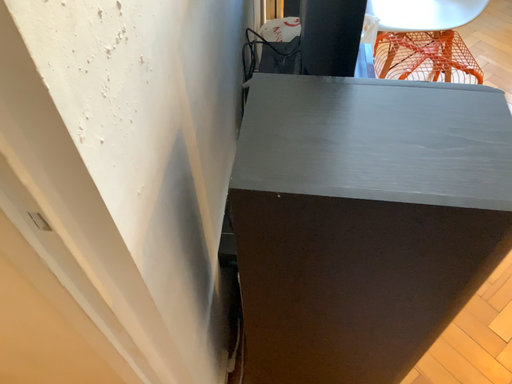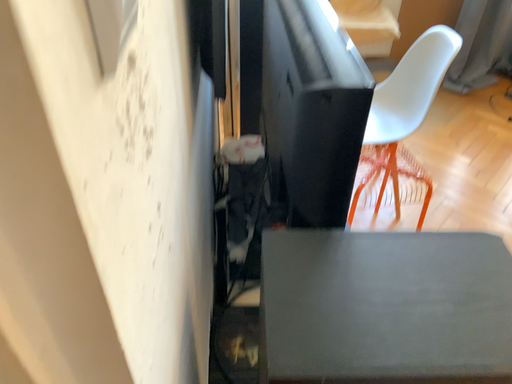
Question: Which way did the camera rotate in the video?

Choices:
 (A) rotated downward
 (B) rotated upward

Answer: (B)